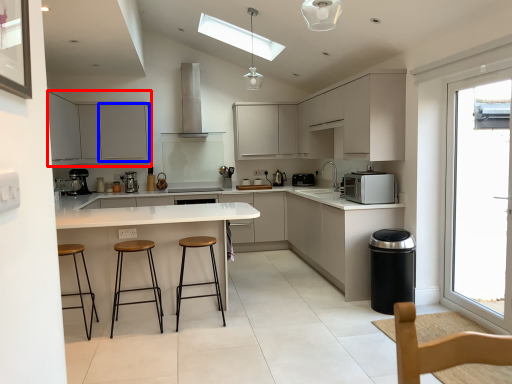
Question: Which of the following is the closest to the observer, cabinetry (highlighted by a red box) or cabinetry (highlighted by a blue box)?

Choices:
 (A) cabinetry
 (B) cabinetry

Answer: (A)